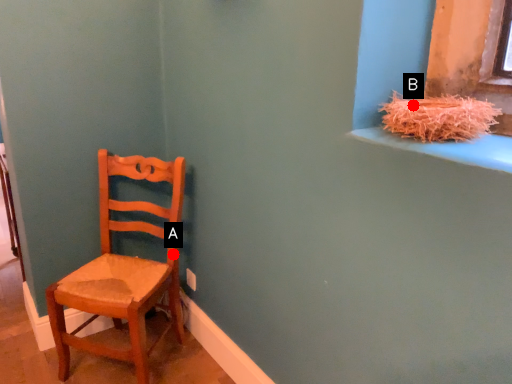
Question: Two points are circled on the image, labeled by A and B beside each circle. Which point is closer to the camera taking this photo?

Choices:
 (A) A is closer
 (B) B is closer

Answer: (B)